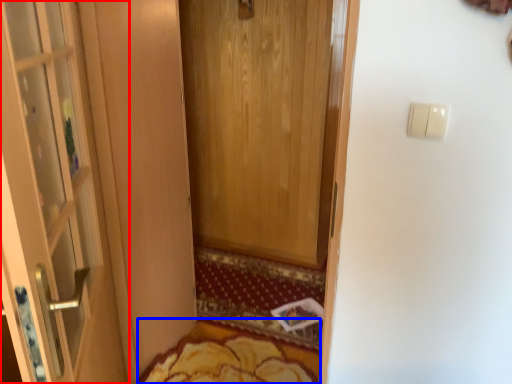
Question: Which of the following is the closest to the observer, door (highlighted by a red box) or mat (highlighted by a blue box)?

Choices:
 (A) door
 (B) mat

Answer: (A)